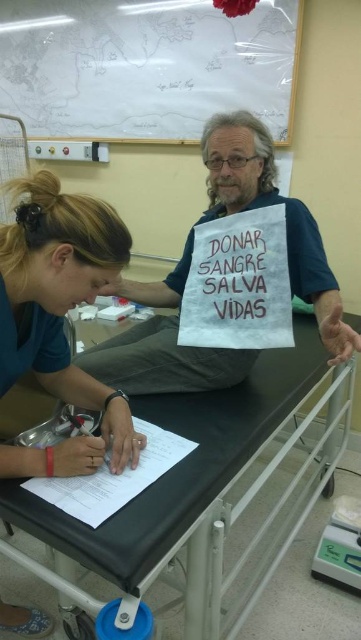
Based on the photo, does matte blue shirt at lower left lie in front of blue fabric sign at center?

Answer: That is True.

Is matte blue shirt at lower left bigger than blue fabric sign at center?

Incorrect, matte blue shirt at lower left is not larger than blue fabric sign at center.

Looking at this image, who is more distant from viewer, (28,330) or (237,204)?

Point (237,204)

Identify the location of matte blue shirt at lower left. The image size is (361, 640). (59, 320).